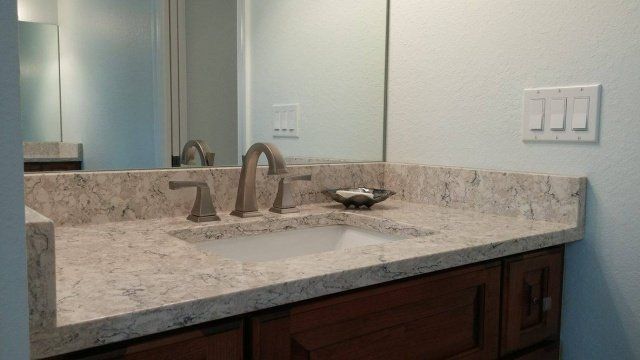
Where is `light switches`? light switches is located at coordinates (532, 121), (559, 125), (577, 122).